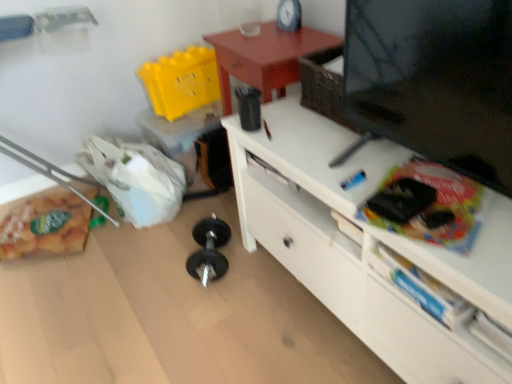
Where is `free location above black matte tv at upper right (from a real-world perspective)`? Image resolution: width=512 pixels, height=384 pixels. free location above black matte tv at upper right (from a real-world perspective) is located at coordinates (365, 160).